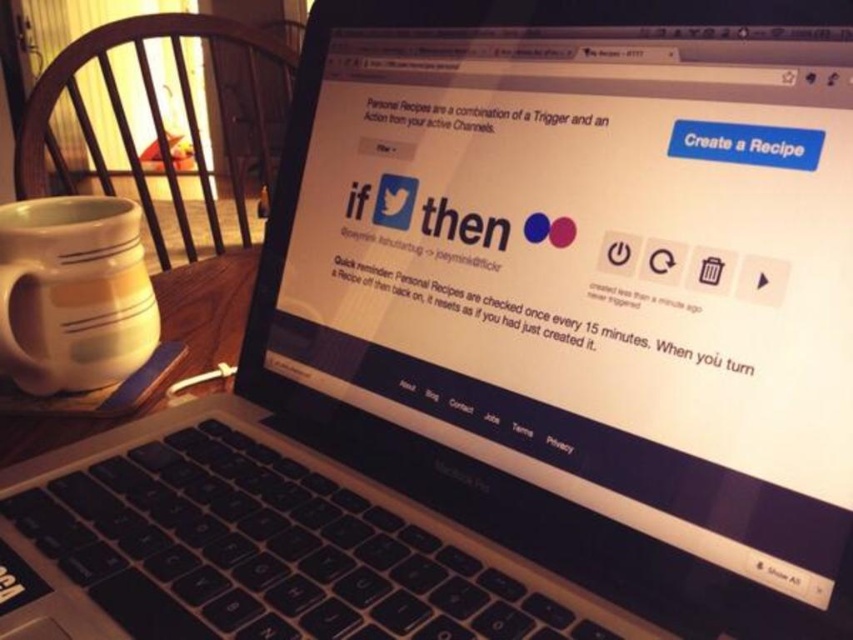
Between white matte mug at left and white ceramic table at lower left, which one appears on the right side from the viewer's perspective?

white ceramic table at lower left is more to the right.

Is white matte mug at left below white ceramic table at lower left?

No, white matte mug at left is not below white ceramic table at lower left.

Is point (108, 324) positioned behind point (0, 442)?

Yes, point (108, 324) is behind point (0, 442).

Identify the location of white matte mug at left. The width and height of the screenshot is (853, 640). (73, 292).